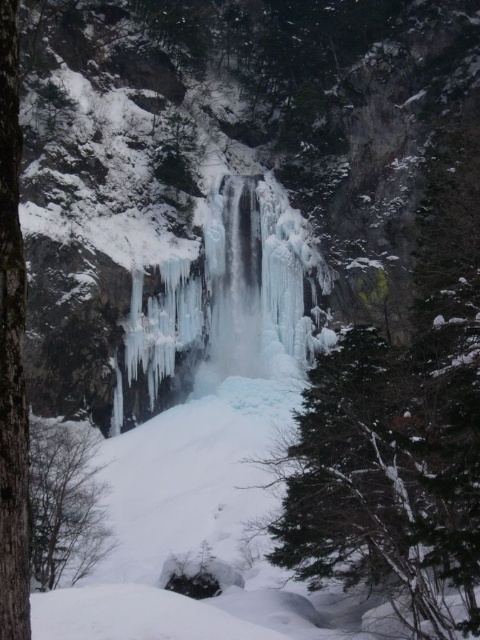
You are a hiker trying to navigate through the winter landscape. You notice the green textured tree at center and the barky brown tree trunk at left. Which tree trunk is closer to you as you face the cliff?

The green textured tree at center is closer to you because the barky brown tree trunk at left is positioned behind it.

You are standing at the base of the frozen waterfall and looking up. There is a point marked at coordinates (388, 470). What object is located at that point?

The point at coordinates (388, 470) indicates a green textured tree at center.

You are standing at the base of the frozen waterfall in the winter landscape. You notice a point marked at coordinates (12, 349). Which object does this point correspond to?

The point at (12, 349) corresponds to the barky brown tree trunk at left.